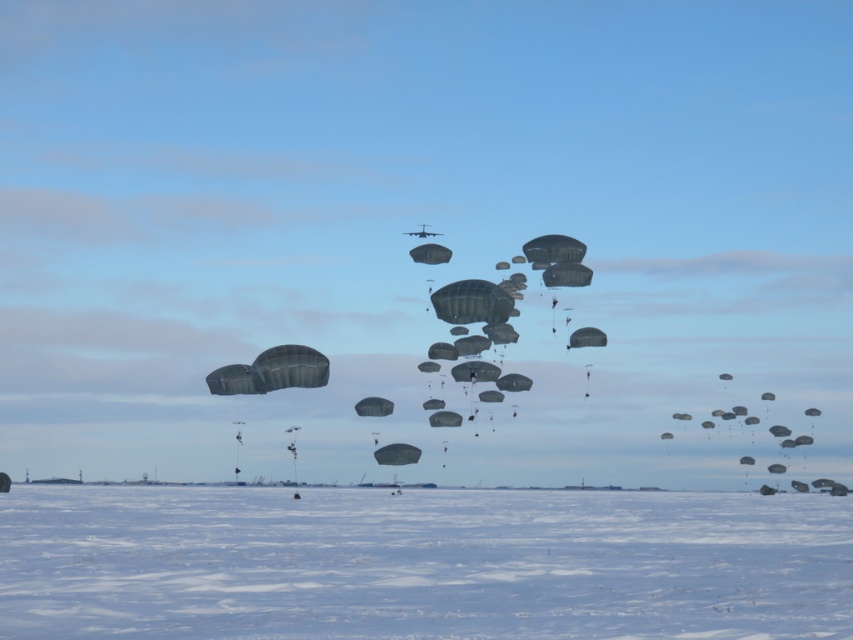
In the scene shown: You are a military observer analyzing the parachute drop operation. The white matte snow at lower center and dark gray matte parachute at center are both visible in your field of view. Which object occupies a greater area in the image?

The white matte snow at lower center has a larger size compared to the dark gray matte parachute at center, so it occupies a greater area in the image.

You are a drone operator controlling a drone that is 1.2 meters tall. Your drone is currently hovering above the white matte snow at lower center. You need to fly the drone to the camera. What is the minimum height you should maintain to ensure the drone does not collide with the camera?

The white matte snow at lower center and camera are 14.88 meters apart. To avoid collision, the drone should maintain a minimum height of at least 14.88 meters above the white matte snow at lower center.